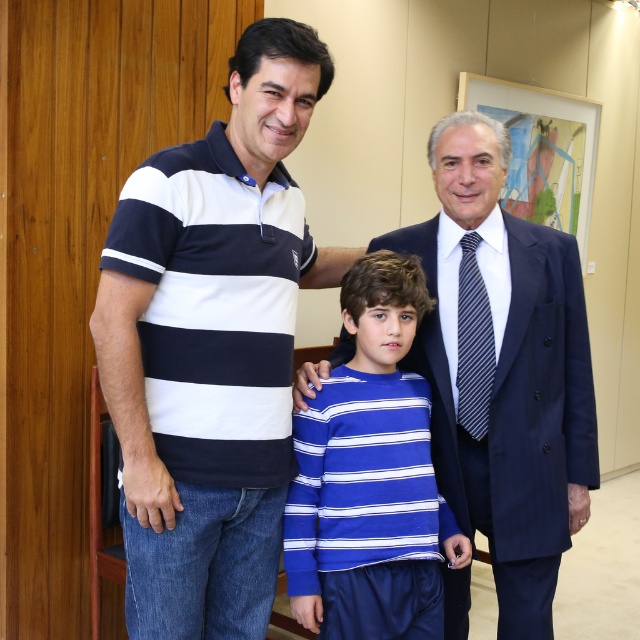
Is navy blue striped polo shirt at center smaller than blue striped shirt at center?

No, navy blue striped polo shirt at center is not smaller than blue striped shirt at center.

Does navy blue striped polo shirt at center appear on the left side of blue striped shirt at center?

Correct, you'll find navy blue striped polo shirt at center to the left of blue striped shirt at center.

Is point (284, 392) farther from viewer compared to point (476, 340)?

No, (284, 392) is closer to viewer.

Identify the location of navy blue striped polo shirt at center. This screenshot has height=640, width=640. (212, 346).

Is blue striped shirt at center to the right of navy blue and white striped polo shirt at left from the viewer's perspective?

Yes, blue striped shirt at center is to the right of navy blue and white striped polo shirt at left.

Between blue striped shirt at center and navy blue and white striped polo shirt at left, which one has more height?

blue striped shirt at center

Who is more distant from viewer, (470, 428) or (234, 253)?

The point (470, 428) is more distant.

Identify the location of blue striped shirt at center. This screenshot has width=640, height=640. (502, 371).

Between point (205, 548) and point (330, 408), which one is positioned in front?

Positioned in front is point (205, 548).

Can you confirm if navy blue striped polo shirt at center is shorter than blue striped sweater at center?

In fact, navy blue striped polo shirt at center may be taller than blue striped sweater at center.

You are a GUI agent. You are given a task and a screenshot of the screen. Output one action in this format:
    pyautogui.click(x=<x>, y=<y>)
    Task: Click on the navy blue striped polo shirt at center
    The width and height of the screenshot is (640, 640).
    Given the screenshot: What is the action you would take?
    pyautogui.click(x=212, y=346)